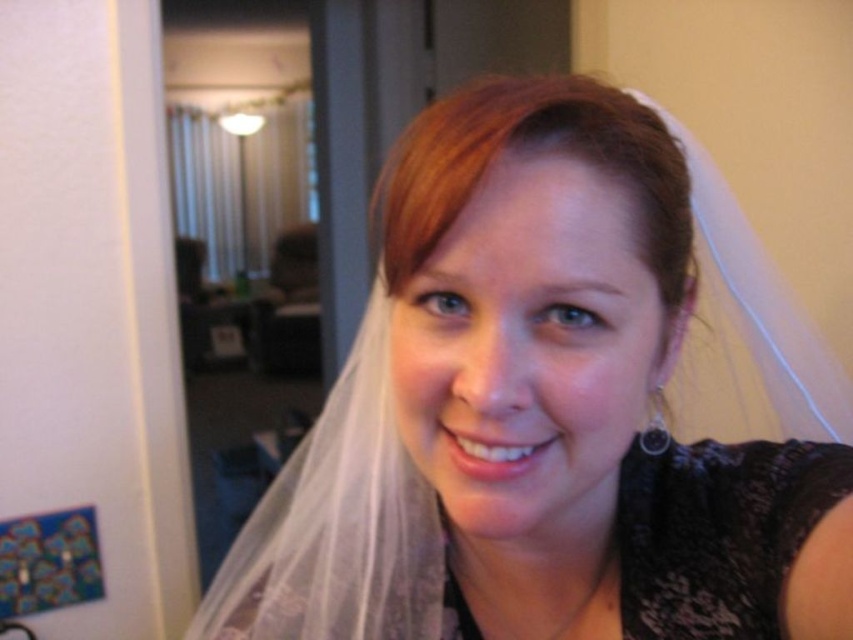
Question: Observing the image, what is the correct spatial positioning of black lace dress at lower right in reference to blonde silky hair at center?

Choices:
 (A) left
 (B) right

Answer: (B)

Question: Which object is positioned farthest from the black lace dress at lower right?

Choices:
 (A) blonde silky hair at center
 (B) translucent white veil at center

Answer: (A)

Question: Can you confirm if black lace dress at lower right is thinner than blonde silky hair at center?

Choices:
 (A) no
 (B) yes

Answer: (A)

Question: Among these objects, which one is farthest from the camera?

Choices:
 (A) blonde silky hair at center
 (B) translucent white veil at center
 (C) black lace dress at lower right

Answer: (C)

Question: Does translucent white veil at center appear under blonde silky hair at center?

Choices:
 (A) yes
 (B) no

Answer: (A)

Question: Which point appears closest to the camera in this image?

Choices:
 (A) (387, 237)
 (B) (679, 554)

Answer: (A)